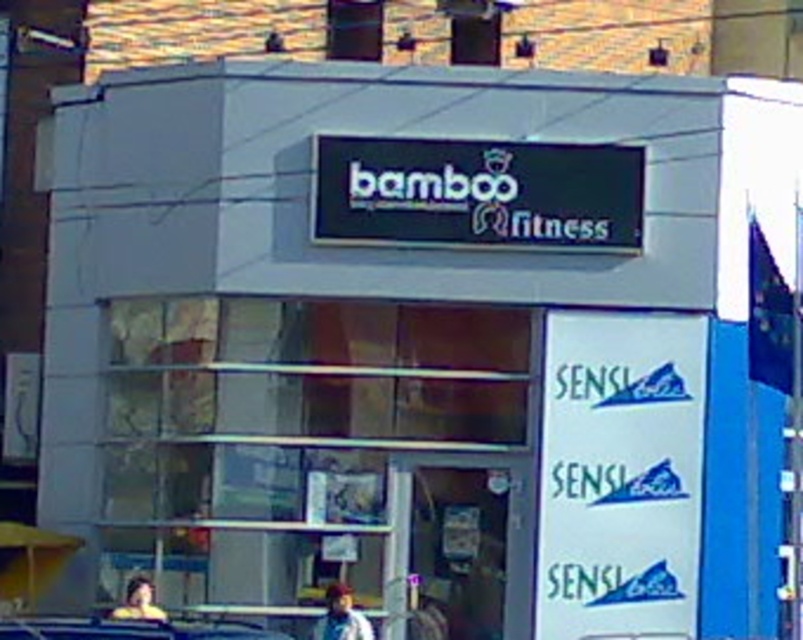
You are a pedestrian standing in front of the Bamboo Fitness storefront. You notice a metallic silver car at lower center and a light brown hair at lower left. Which object is taller?

The light brown hair at lower left is taller than the metallic silver car at lower center.

You are standing at the entrance of Bamboo Fitness and want to park your metallic silver car at lower center. The parking lot has a designated parking spot at coordinate point 0.984, 0.159. Can you confirm if your car is already parked in the correct spot?

Yes, the metallic silver car at lower center is parked at the designated parking spot at coordinate point (127, 628).